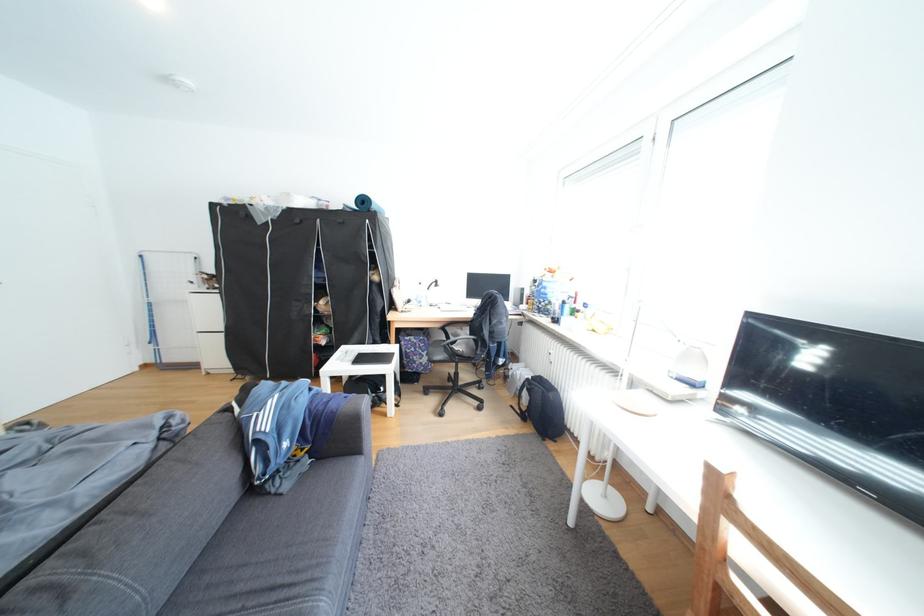
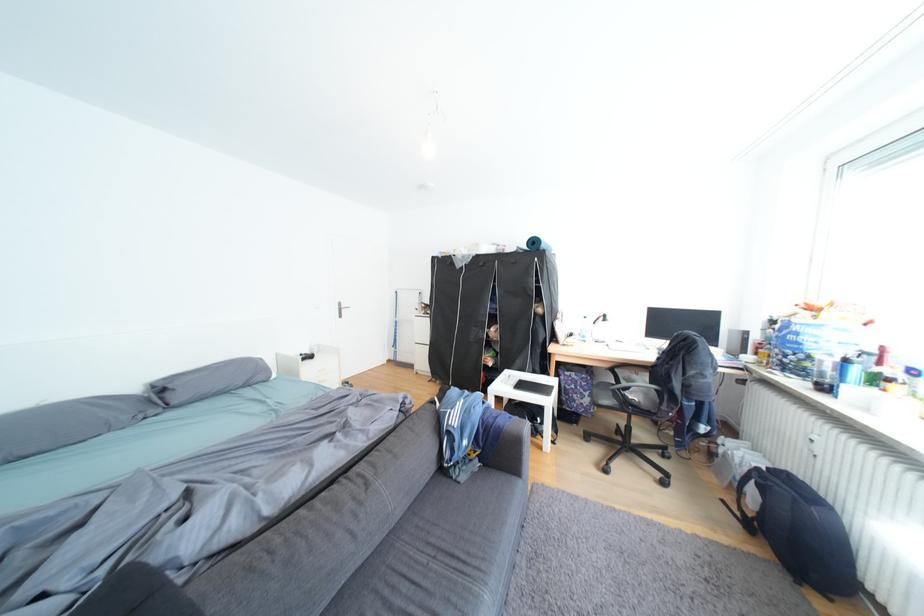
The point at [460,345] is marked in the first image. Where is the corresponding point in the second image?

(631, 390)